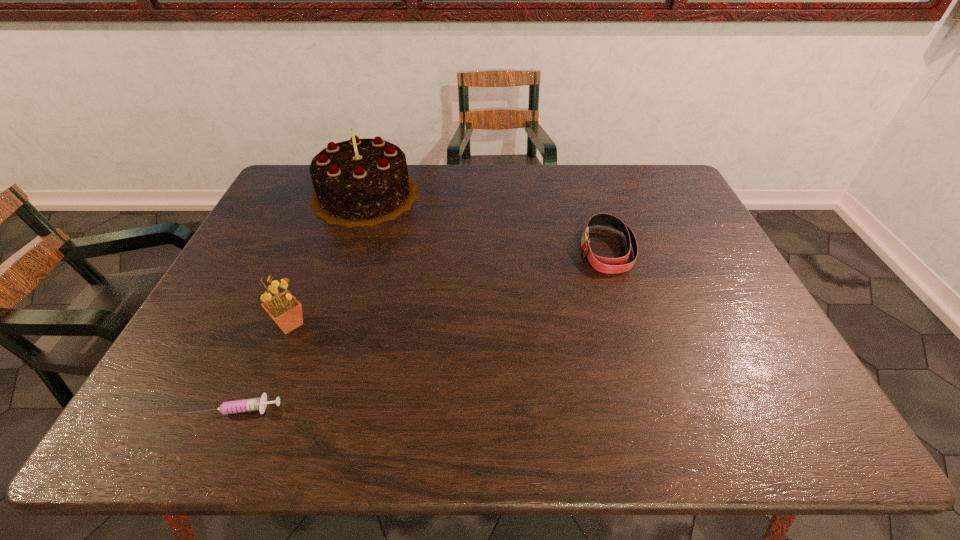
Where is `free space at the right edge`? The image size is (960, 540). free space at the right edge is located at coordinates (689, 279).

Locate an element on the screen. This screenshot has height=540, width=960. unoccupied area between the rightmost object and the second nearest object is located at coordinates (448, 287).

This screenshot has width=960, height=540. What are the coordinates of `blank region between the second shortest object and the birthday cake` in the screenshot? It's located at (486, 222).

Where is `vacant space that is in between the rightmost object and the nearest object`? vacant space that is in between the rightmost object and the nearest object is located at coordinates (422, 328).

Find the location of a particular element. The height and width of the screenshot is (540, 960). empty space between the nearest object and the rightmost object is located at coordinates (422, 328).

Locate an element on the screen. The height and width of the screenshot is (540, 960). empty location between the rightmost object and the tallest object is located at coordinates (486, 222).

Identify the location of empty space that is in between the sunflower and the birthday cake. The width and height of the screenshot is (960, 540). (327, 259).

Image resolution: width=960 pixels, height=540 pixels. In order to click on free spot between the third tallest object and the tallest object in this screenshot , I will do `click(486, 222)`.

Identify the location of vacant area between the second nearest object and the dog collar. (448, 287).

Identify the location of free point between the second shortest object and the second tallest object. The image size is (960, 540). (448, 287).